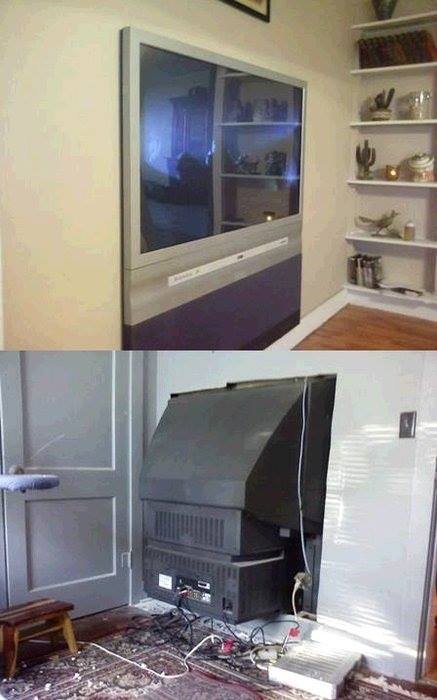
Image resolution: width=437 pixels, height=700 pixels. Find the location of `cables`. cables is located at coordinates (300, 535), (293, 596), (111, 652), (175, 636), (235, 637).